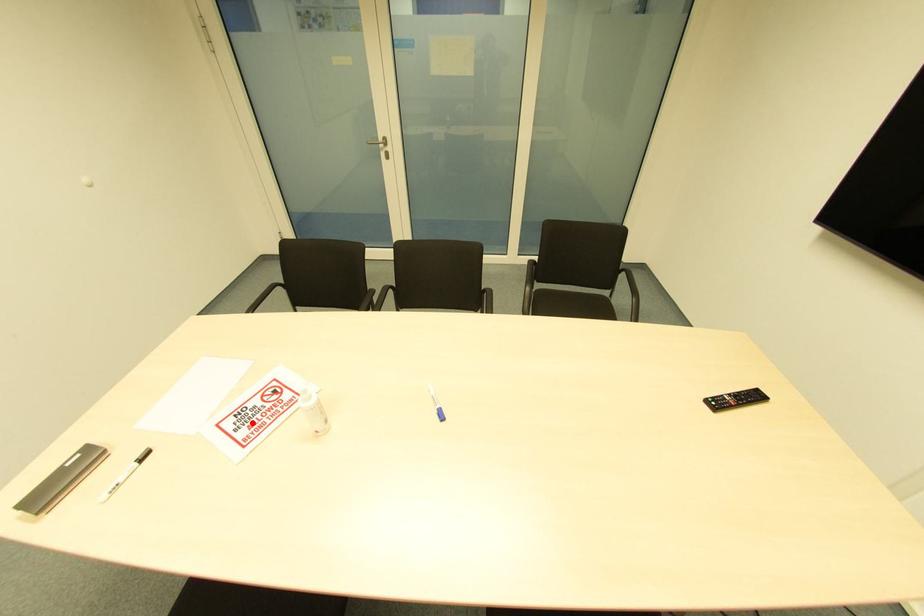
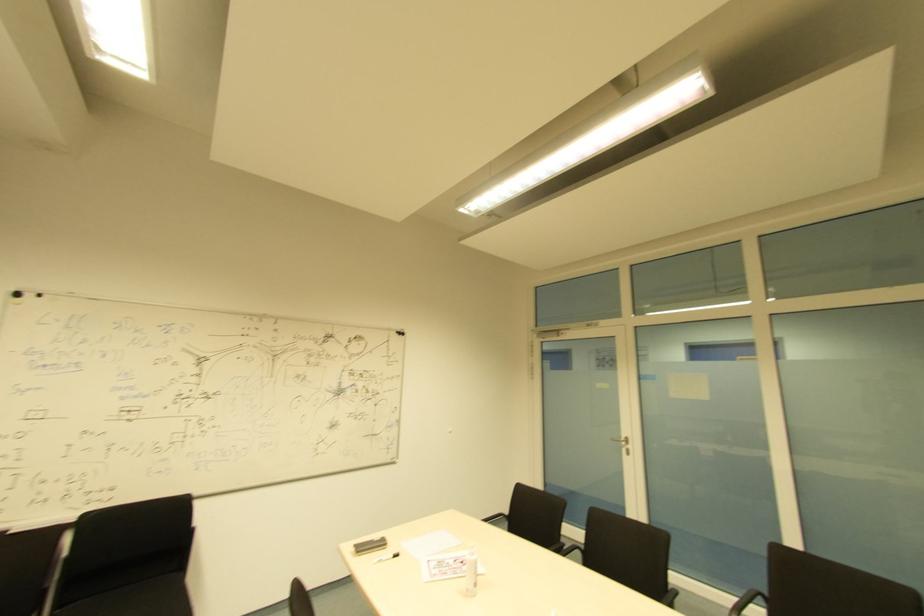
The point at the highlighted location is marked in the first image. Where is the corresponding point in the second image?

(444, 572)